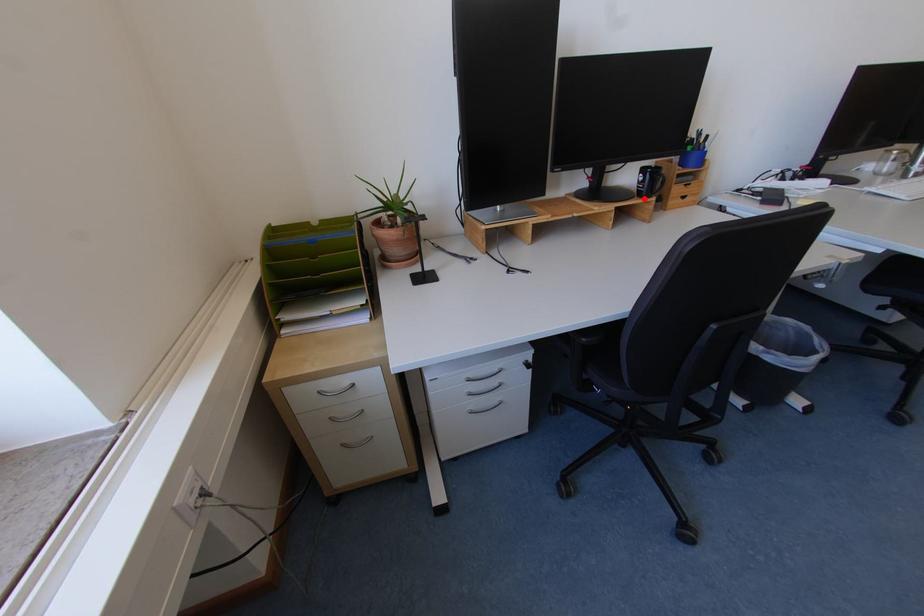
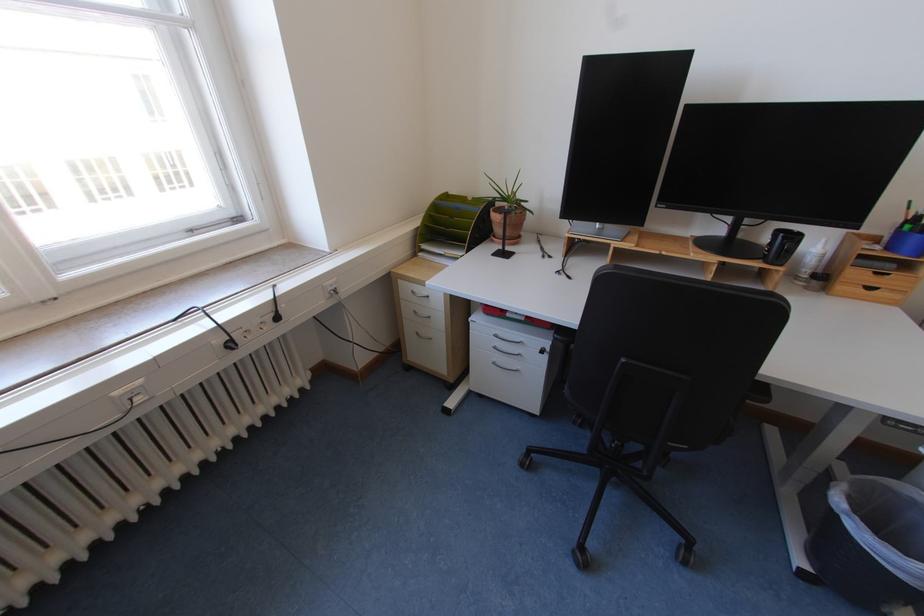
Find the pixel in the second image that matches the highlighted location in the first image.

(769, 262)